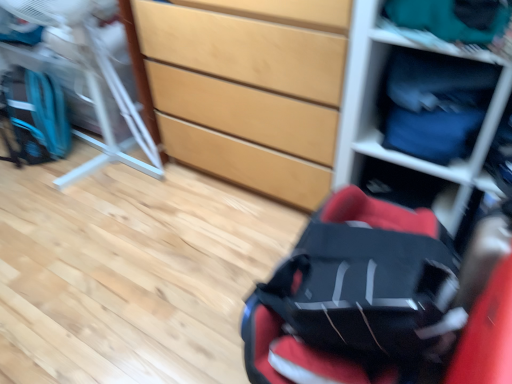
Question: Considering the relative sizes of teal fabric at upper right and metallic silver folding chair at left in the image provided, is teal fabric at upper right bigger than metallic silver folding chair at left?

Choices:
 (A) yes
 (B) no

Answer: (B)

Question: From a real-world perspective, is teal fabric at upper right positioned over metallic silver folding chair at left based on gravity?

Choices:
 (A) yes
 (B) no

Answer: (A)

Question: Does teal fabric at upper right have a greater height compared to metallic silver folding chair at left?

Choices:
 (A) no
 (B) yes

Answer: (A)

Question: Can you confirm if teal fabric at upper right is positioned to the right of metallic silver folding chair at left?

Choices:
 (A) yes
 (B) no

Answer: (A)

Question: Is teal fabric at upper right wider than metallic silver folding chair at left?

Choices:
 (A) yes
 (B) no

Answer: (B)

Question: Is teal fabric at upper right to the left of metallic silver folding chair at left from the viewer's perspective?

Choices:
 (A) no
 (B) yes

Answer: (A)

Question: Is red fabric baby carriage at center at the left side of teal fabric at upper right?

Choices:
 (A) yes
 (B) no

Answer: (A)

Question: Is red fabric baby carriage at center beside teal fabric at upper right?

Choices:
 (A) no
 (B) yes

Answer: (A)

Question: Does red fabric baby carriage at center come in front of teal fabric at upper right?

Choices:
 (A) no
 (B) yes

Answer: (B)

Question: Could you tell me if red fabric baby carriage at center is turned towards teal fabric at upper right?

Choices:
 (A) no
 (B) yes

Answer: (A)

Question: From a real-world perspective, is red fabric baby carriage at center positioned under teal fabric at upper right based on gravity?

Choices:
 (A) no
 (B) yes

Answer: (B)

Question: Is red fabric baby carriage at center positioned behind teal fabric at upper right?

Choices:
 (A) no
 (B) yes

Answer: (A)

Question: Is teal fabric at upper right turned away from red fabric baby carriage at center?

Choices:
 (A) no
 (B) yes

Answer: (A)